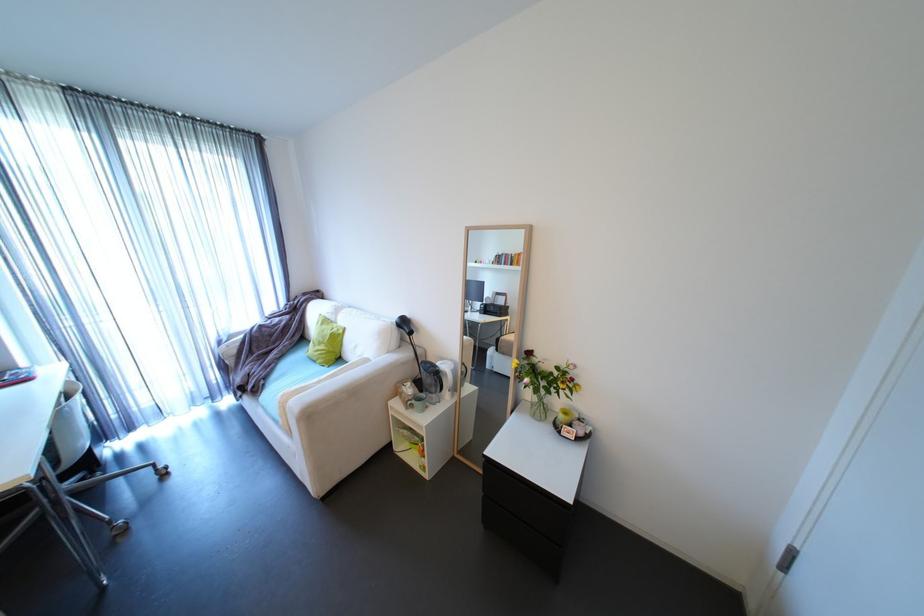
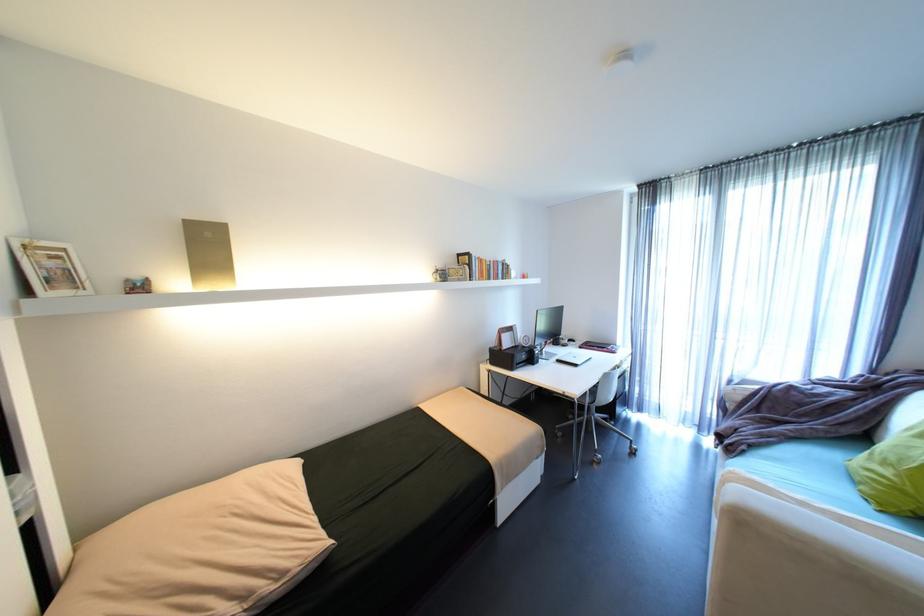
Question: Based on the continuous images, in which direction is the camera rotating? Reply with the corresponding letter.

Choices:
 (A) Left
 (B) Right
 (C) Up
 (D) Down

Answer: (A)